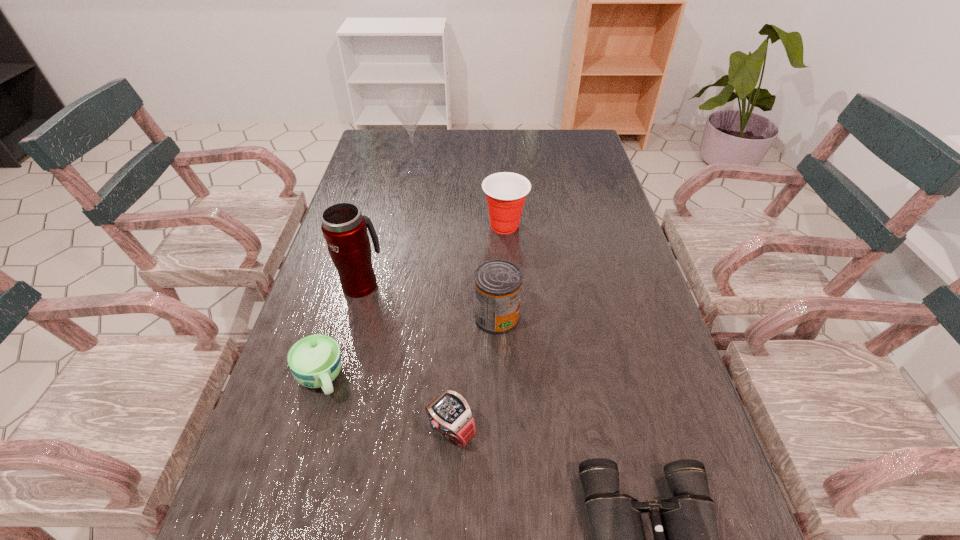
The image size is (960, 540). I want to click on free point between the watch and the taller cup, so click(x=478, y=328).

The height and width of the screenshot is (540, 960). In order to click on free space between the shorter cup and the can in this screenshot , I will do `click(409, 348)`.

Identify which object is the fourth closest to the watch. Please provide its 2D coordinates. Your answer should be formatted as a tuple, i.e. [(x, y)], where the tuple contains the x and y coordinates of a point satisfying the conditions above.

[(344, 228)]

Identify the location of the sixth closest object to the nearer cup. Image resolution: width=960 pixels, height=540 pixels. (408, 104).

Locate an element on the screen. The image size is (960, 540). vacant space that satisfies the following two spatial constraints: 1. on the back side of the second farthest object; 2. on the right side of the can is located at coordinates (493, 226).

Identify the location of vacant area in the image that satisfies the following two spatial constraints: 1. on the front side of the can; 2. on the right side of the farthest object. (387, 317).